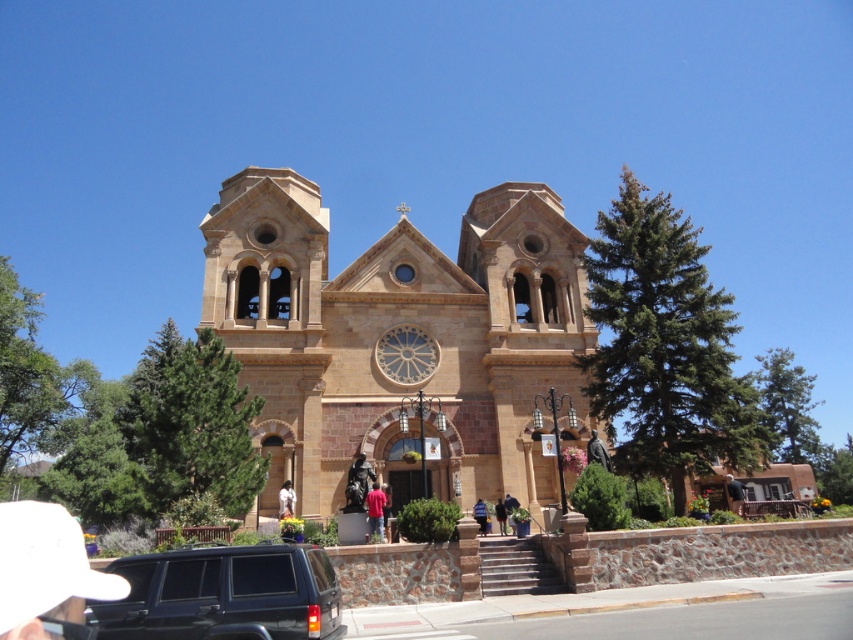
You are standing in front of the historic church and notice two points marked on the facade. The first point is at coordinates point (294, 500) and the second is at point (497, 520). Which of these points is closer to you?

Point (294, 500) is closer to the viewer than point (497, 520).

You are a photographer planning to take a portrait of someone wearing a red cotton shirt at center and dark blue jeans at lower center in front of the historic church. Considering the composition, which clothing item will take up more visual space in the photo?

The dark blue jeans at lower center will take up more visual space in the photo because the red cotton shirt at center occupies less space than dark blue jeans at lower center.